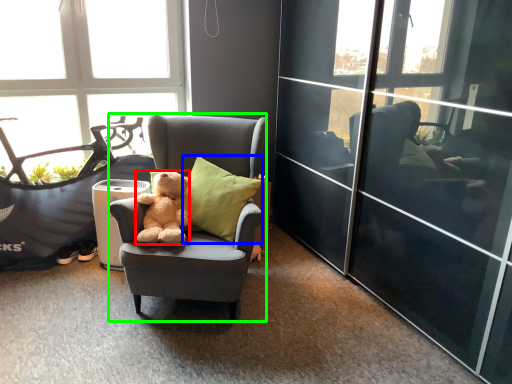
Question: Which object is the closest to the teddy bear (highlighted by a red box)? Choose among these: pillow (highlighted by a blue box) or chair (highlighted by a green box).

Choices:
 (A) pillow
 (B) chair

Answer: (A)